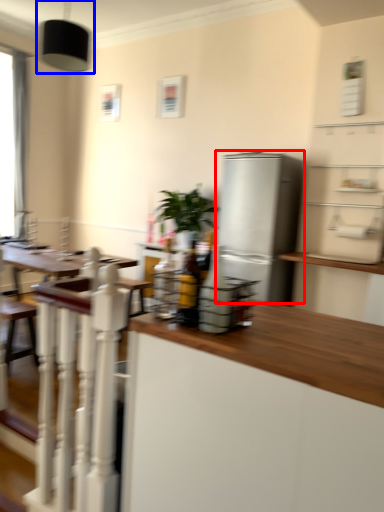
Question: Which of the following is the closest to the observer, refrigerator (highlighted by a red box) or light fixture (highlighted by a blue box)?

Choices:
 (A) refrigerator
 (B) light fixture

Answer: (B)